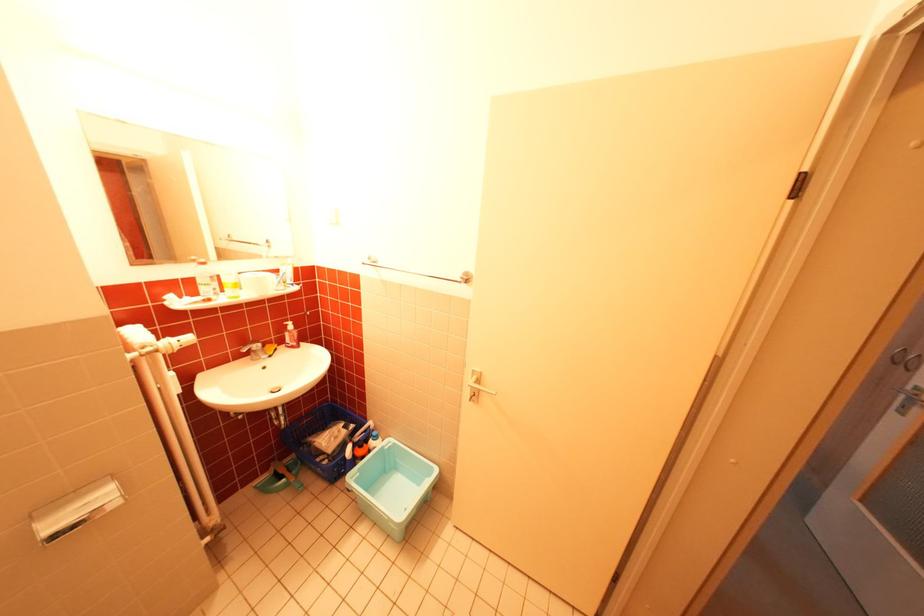
This screenshot has height=616, width=924. Find the location of `silver door handle`. silver door handle is located at coordinates (478, 391).